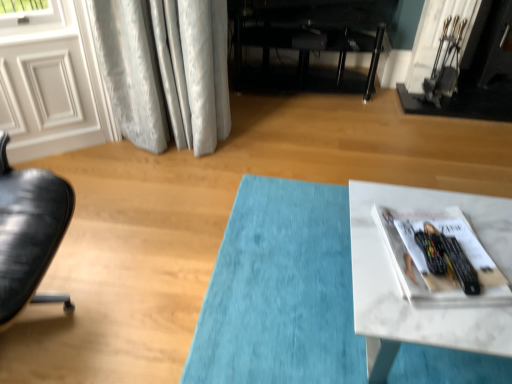
Question: From the image's perspective, is white glossy door at upper left located above or below black metal fireplace at upper right?

Choices:
 (A) above
 (B) below

Answer: (B)

Question: From a real-world perspective, is white glossy door at upper left physically located above or below black metal fireplace at upper right?

Choices:
 (A) above
 (B) below

Answer: (B)

Question: Considering the real-world distances, which object is farthest from the black glossy entertainment center at center?

Choices:
 (A) white glossy door at upper left
 (B) white glossy magazine at lower right
 (C) white marble table at lower right
 (D) black metal fireplace at upper right

Answer: (B)

Question: Based on their relative distances, which object is nearer to the white glossy door at upper left?

Choices:
 (A) black glossy entertainment center at center
 (B) black metal fireplace at upper right
 (C) white glossy magazine at lower right
 (D) white marble table at lower right

Answer: (A)